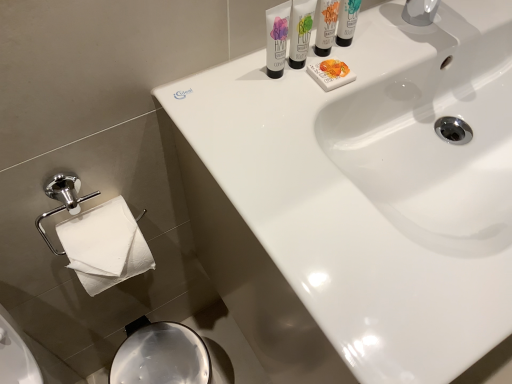
Locate an element on the screen. The width and height of the screenshot is (512, 384). free spot to the left of white matte soap at upper center is located at coordinates (234, 97).